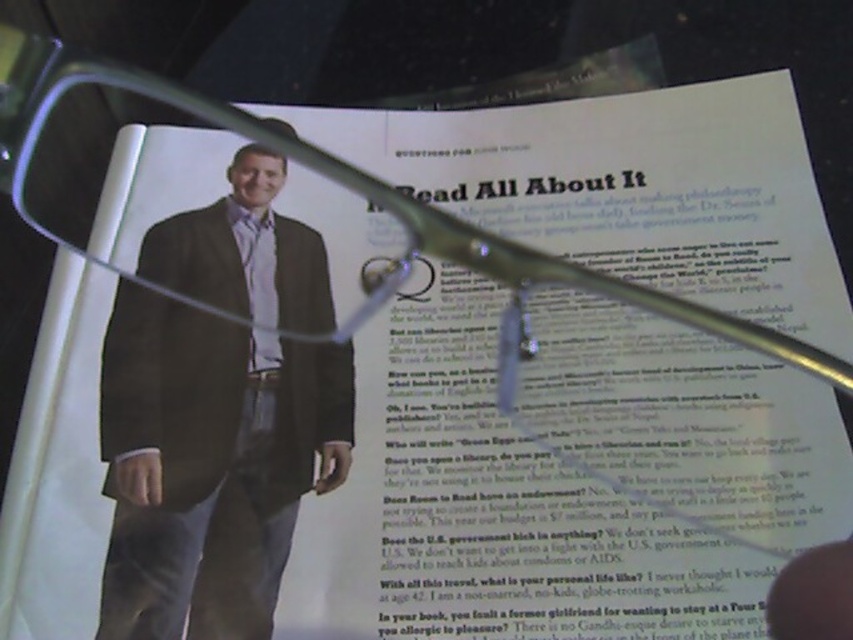
You are designing a layout for a magazine article. The article will feature the matte brown suit at center and the matte black tie at center. The editor wants to ensure that the visual hierarchy emphasizes the suit over the tie. Based on the provided description, which object should be placed in a position of prominence to achieve this?

The matte brown suit at center should be placed in a position of prominence because it is larger in size compared to the matte black tie at center, making it naturally draw more attention.

You are a tailor who needs to adjust the position of the matte brown suit at center and the matte black tie at center on the printed page. According to the image, which item is positioned lower?

The matte brown suit at center is below the matte black tie at center, so the matte brown suit at center is positioned lower.